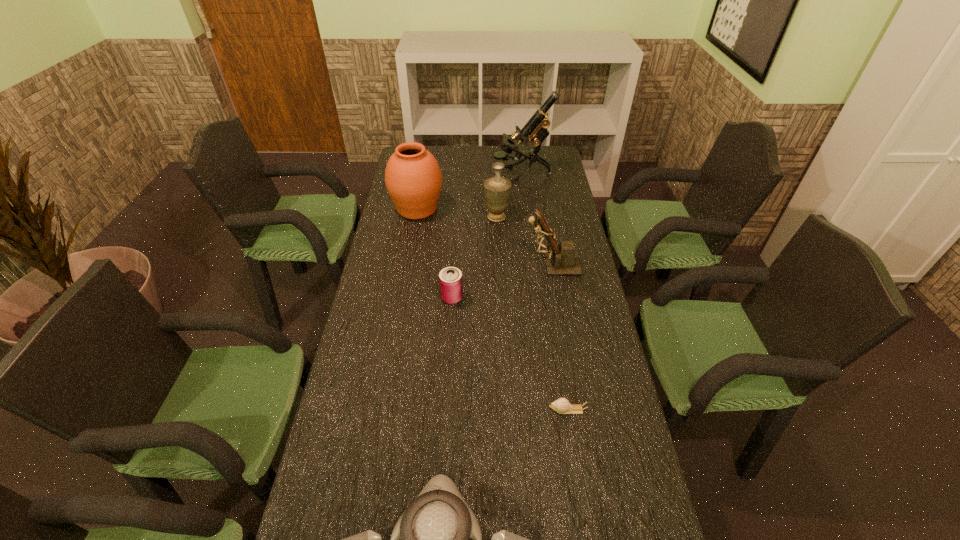
The width and height of the screenshot is (960, 540). In order to click on free space between the left urn and the right urn in this screenshot , I will do `click(457, 213)`.

You are a GUI agent. You are given a task and a screenshot of the screen. Output one action in this format:
    pyautogui.click(x=<x>, y=<y>)
    Task: Click on the vacant point located between the fifth farthest object and the figurine
    This screenshot has width=960, height=540.
    Given the screenshot: What is the action you would take?
    pyautogui.click(x=502, y=281)

Locate an element on the screen. The width and height of the screenshot is (960, 540). free area in between the escargot and the fourth nearest object is located at coordinates point(560,336).

At what (x,y) coordinates should I click in order to perform the action: click on the closest object to the farthest object. Please return your answer as a coordinate pair (x, y). Looking at the image, I should click on (497, 189).

The height and width of the screenshot is (540, 960). In order to click on object that is the closest one to the left urn in this screenshot , I will do `click(497, 189)`.

At what (x,y) coordinates should I click in order to perform the action: click on blank area in the image that satisfies the following two spatial constraints: 1. on the back side of the can; 2. on the left side of the right urn. Please return your answer as a coordinate pair (x, y). The height and width of the screenshot is (540, 960). Looking at the image, I should click on (457, 217).